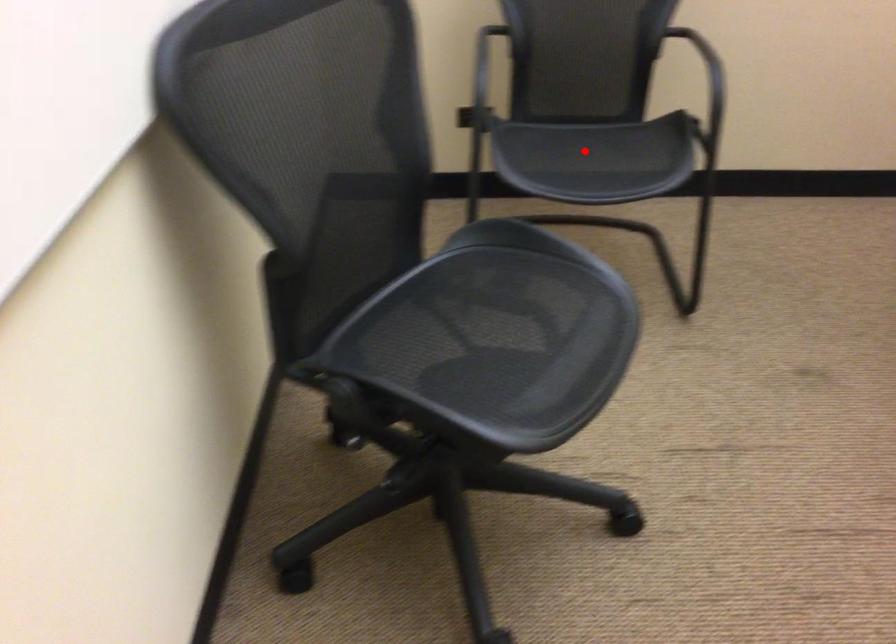
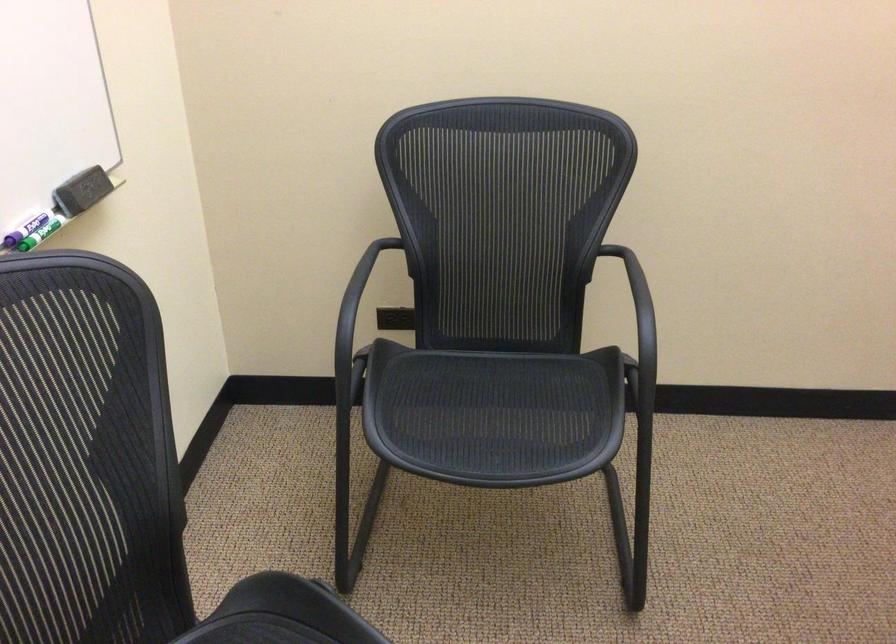
Question: I am providing you with two images of the same scene from different viewpoints. Given a red point in image1, look at the same physical point in image2. Is it:

Choices:
 (A) Closer to the viewpoint
 (B) Farther from the viewpoint

Answer: (A)